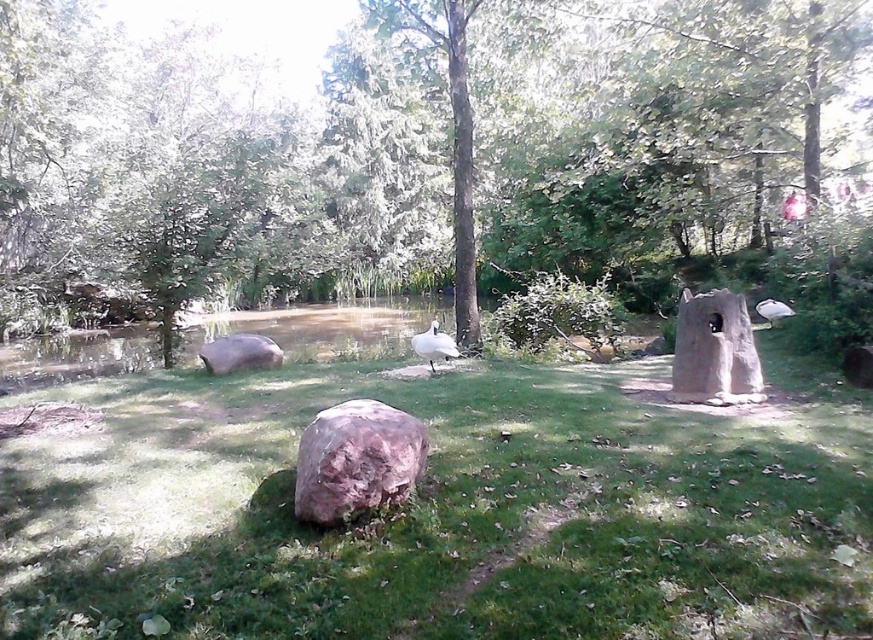
Question: Based on their relative distances, which object is nearer to the smooth gray rock at lower left?

Choices:
 (A) green grassy at center
 (B) rusty stone boulder at center

Answer: (A)

Question: Which object is positioned closest to the green leafy tree at center?

Choices:
 (A) white matte bird at center
 (B) white glossy bird at upper right
 (C) green grassy at center
 (D) rusty stone boulder at center

Answer: (D)

Question: Is green grassy at center above white matte bird at center?

Choices:
 (A) yes
 (B) no

Answer: (B)

Question: Which object appears closest to the camera in this image?

Choices:
 (A) green leafy tree at center
 (B) white glossy bird at upper right
 (C) white matte bird at center

Answer: (C)

Question: Is green grassy at center thinner than white glossy bird at upper right?

Choices:
 (A) no
 (B) yes

Answer: (A)

Question: Does smooth gray rock at lower left have a larger size compared to white matte bird at center?

Choices:
 (A) no
 (B) yes

Answer: (B)